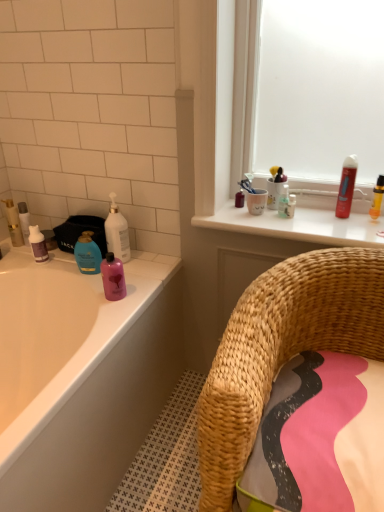
The width and height of the screenshot is (384, 512). In order to click on spots to the right of translucent plastic toothbrush at upper center, which appears as the 4th toiletry when viewed from the left in this screenshot , I will do `click(320, 216)`.